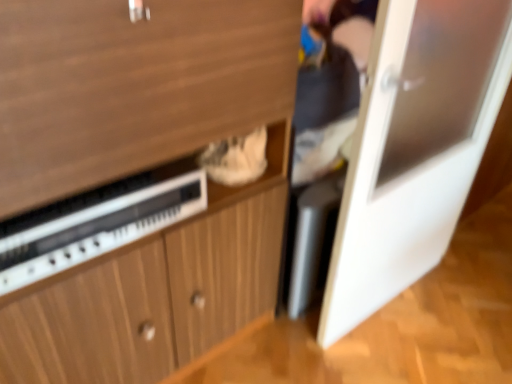
The height and width of the screenshot is (384, 512). Describe the element at coordinates (98, 228) in the screenshot. I see `white plastic radio at lower left` at that location.

Find the location of a particular element. This screenshot has width=512, height=384. white plastic radio at lower left is located at coordinates (98, 228).

This screenshot has width=512, height=384. What do you see at coordinates (139, 170) in the screenshot? I see `wooden cabinet at center` at bounding box center [139, 170].

The width and height of the screenshot is (512, 384). In order to click on white plastic radio at lower left in this screenshot , I will do `click(98, 228)`.

Does point (28, 79) come behind point (177, 205)?

No, (28, 79) is closer to viewer.

From a real-world perspective, between wooden cabinet at center and white plastic radio at lower left, who is vertically lower?

From a 3D spatial view, wooden cabinet at center is below.

Would you say wooden cabinet at center is a long distance from white plastic radio at lower left?

No, wooden cabinet at center is in close proximity to white plastic radio at lower left.

Does wooden cabinet at center have a greater width compared to white plastic radio at lower left?

Correct, the width of wooden cabinet at center exceeds that of white plastic radio at lower left.

Is white plastic radio at lower left at the left side of wooden cabinet at center?

Indeed, white plastic radio at lower left is positioned on the left side of wooden cabinet at center.

How much distance is there between white plastic radio at lower left and wooden cabinet at center?

white plastic radio at lower left and wooden cabinet at center are 6.45 inches apart.

Between white plastic radio at lower left and wooden cabinet at center, which one has larger width?

With larger width is wooden cabinet at center.

Is there a large distance between white plastic radio at lower left and wooden cabinet at center?

No, white plastic radio at lower left is not far away from wooden cabinet at center.

Considering the relative sizes of white glossy door at right and white plastic radio at lower left in the image provided, is white glossy door at right shorter than white plastic radio at lower left?

In fact, white glossy door at right may be taller than white plastic radio at lower left.

In order to click on door below the white plastic radio at lower left (from a real-world perspective) in this screenshot , I will do `click(414, 148)`.

Could white plastic radio at lower left be considered to be inside white glossy door at right?

That's incorrect, white plastic radio at lower left is not inside white glossy door at right.

From a real-world perspective, between white glossy door at right and white plastic radio at lower left, who is vertically lower?

white glossy door at right, from a real-world perspective.

How far apart are wooden cabinet at center and white glossy door at right?

wooden cabinet at center and white glossy door at right are 23.51 inches apart from each other.

Where is `door that is under the wooden cabinet at center (from a real-world perspective)`? door that is under the wooden cabinet at center (from a real-world perspective) is located at coordinates pyautogui.click(x=414, y=148).

Would you consider wooden cabinet at center to be distant from white glossy door at right?

That's not correct — wooden cabinet at center is a little close to white glossy door at right.

Between wooden cabinet at center and white glossy door at right, which one is positioned behind?

white glossy door at right is more distant.

Is white plastic radio at lower left facing away from white glossy door at right?

No, white glossy door at right is not at the back of white plastic radio at lower left.

Does white plastic radio at lower left appear on the right side of white glossy door at right?

No, white plastic radio at lower left is not to the right of white glossy door at right.

From a real-world perspective, does white plastic radio at lower left stand above white glossy door at right?

Yes, from a real-world perspective, white plastic radio at lower left is on top of white glossy door at right.

Who is smaller, white glossy door at right or wooden cabinet at center?

white glossy door at right is smaller.

What's the angular difference between white glossy door at right and wooden cabinet at center's facing directions?

The angle between the facing direction of white glossy door at right and the facing direction of wooden cabinet at center is 6.04 degrees.

From the image's perspective, is white glossy door at right on top of wooden cabinet at center?

Yes, from the image's perspective, white glossy door at right is over wooden cabinet at center.

Consider the image. From a real-world perspective, is white glossy door at right above or below wooden cabinet at center?

From a real-world perspective, white glossy door at right is physically below wooden cabinet at center.

Where is `appliance lying above the wooden cabinet at center (from the image's perspective)`? appliance lying above the wooden cabinet at center (from the image's perspective) is located at coordinates (98, 228).

This screenshot has height=384, width=512. Find the location of `appliance located above the wooden cabinet at center (from a real-world perspective)`. appliance located above the wooden cabinet at center (from a real-world perspective) is located at coordinates (98, 228).

Based on their spatial positions, is white plastic radio at lower left or wooden cabinet at center further from white glossy door at right?

Based on the image, white plastic radio at lower left appears to be further to white glossy door at right.

Estimate the real-world distances between objects in this image. Which object is closer to wooden cabinet at center, white plastic radio at lower left or white glossy door at right?

white plastic radio at lower left lies closer to wooden cabinet at center than the other object.

Which object lies nearer to the anchor point white plastic radio at lower left, wooden cabinet at center or white glossy door at right?

wooden cabinet at center.

Based on the photo, from the image, which object appears to be nearer to white glossy door at right, wooden cabinet at center or white plastic radio at lower left?

The object closer to white glossy door at right is wooden cabinet at center.

Considering their positions, is white glossy door at right positioned further to white plastic radio at lower left than wooden cabinet at center?

white glossy door at right lies further to white plastic radio at lower left than the other object.

Estimate the real-world distances between objects in this image. Which object is further from wooden cabinet at center, white glossy door at right or white plastic radio at lower left?

white glossy door at right is further to wooden cabinet at center.

The image size is (512, 384). I want to click on cabinetry between white plastic radio at lower left and white glossy door at right in the horizontal direction, so click(139, 170).